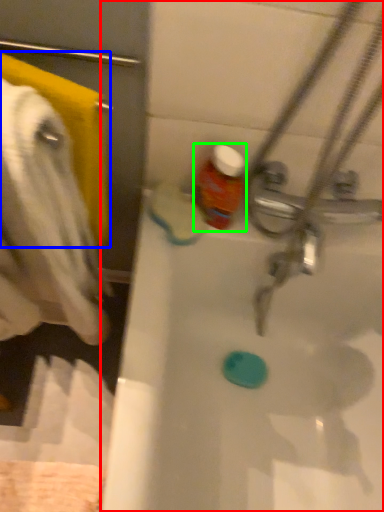
Question: Based on their relative distances, which object is farther from bathtub (highlighted by a red box)? Choose from towel/napkin (highlighted by a blue box) and bottle (highlighted by a green box).

Choices:
 (A) towel/napkin
 (B) bottle

Answer: (A)